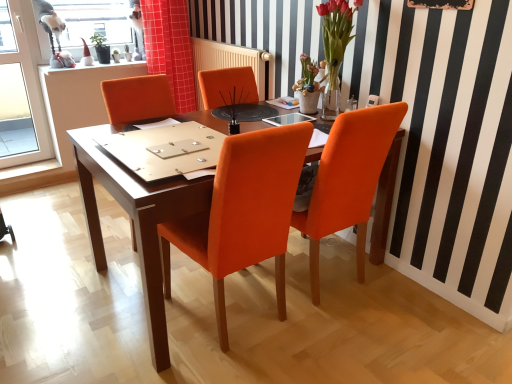
You are a GUI agent. You are given a task and a screenshot of the screen. Output one action in this format:
    pyautogui.click(x=<x>, y=<y>)
    Task: Click on the vacant space in front of orange leather chair at center, which appears as the second chair when viewed from the left
    The image size is (512, 384).
    Given the screenshot: What is the action you would take?
    pyautogui.click(x=350, y=345)